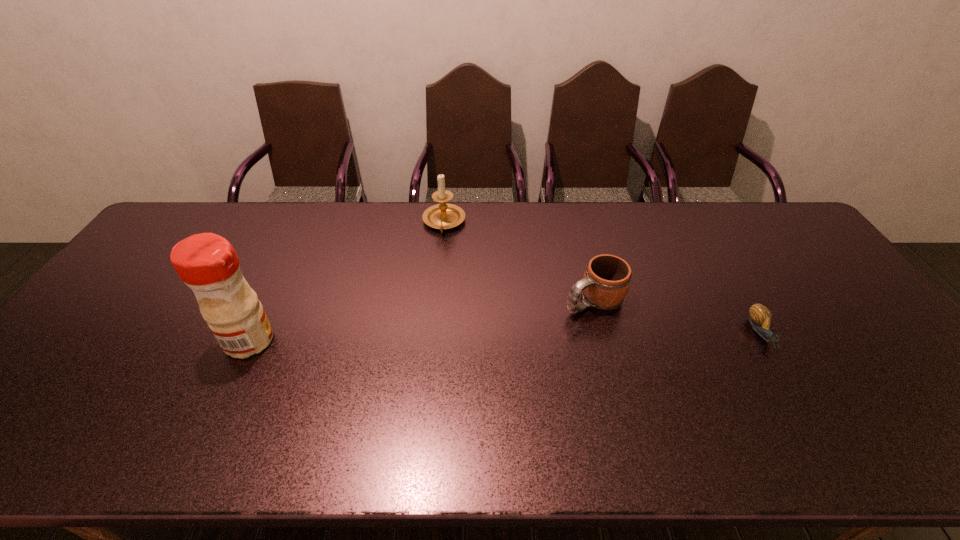
The image size is (960, 540). I want to click on vacant space on the desktop that is between the leftmost object and the shortest object and is positioned on the side of the second object from right to left with the handle, so click(528, 337).

Locate an element on the screen. The height and width of the screenshot is (540, 960). free space on the desktop that is between the leftmost object and the escargot and is positioned with a handle on the side of the farthest object is located at coordinates (438, 338).